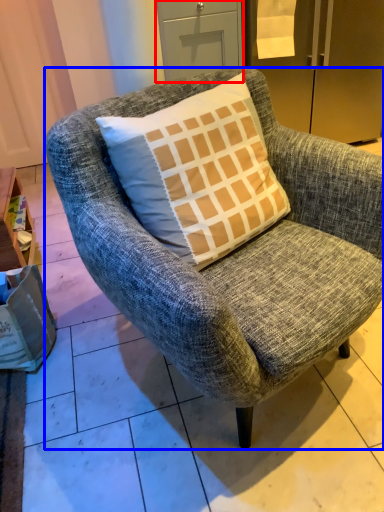
Question: Which object is further to the camera taking this photo, drawer (highlighted by a red box) or chair (highlighted by a blue box)?

Choices:
 (A) drawer
 (B) chair

Answer: (A)